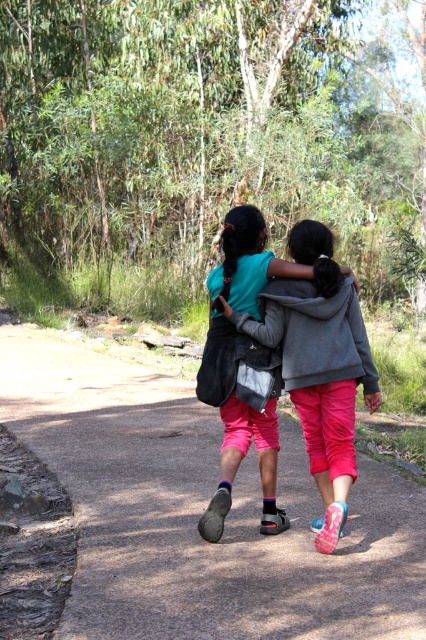
You are standing at the starting point of the dirt path at center and want to reach the matte gray hoodie at center. Which direction should you walk to get there?

You should walk to the right because the dirt path at center is to the left of the matte gray hoodie at center, so moving right along the path will lead you towards the matte gray hoodie at center.